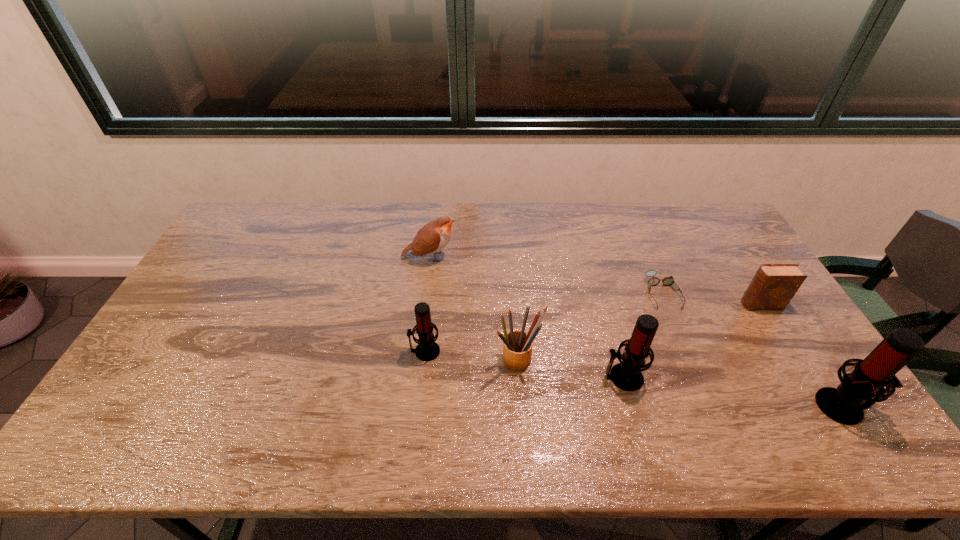
Locate an element on the screen. The width and height of the screenshot is (960, 540). the leftmost microphone is located at coordinates (427, 349).

The height and width of the screenshot is (540, 960). Identify the location of the shortest microphone. (427, 349).

This screenshot has width=960, height=540. What are the coordinates of `the second shortest microphone` in the screenshot? It's located at (626, 375).

Locate an element on the screen. The height and width of the screenshot is (540, 960). the second microphone from left to right is located at coordinates click(x=626, y=375).

This screenshot has height=540, width=960. I want to click on the tallest object, so click(863, 387).

I want to click on the rightmost microphone, so click(x=863, y=387).

I want to click on spectacles, so (x=667, y=281).

This screenshot has width=960, height=540. I want to click on the fifth object from left to right, so click(667, 281).

Where is `bird`? Image resolution: width=960 pixels, height=540 pixels. bird is located at coordinates pos(434,236).

Where is `pencil box`? pencil box is located at coordinates (517, 345).